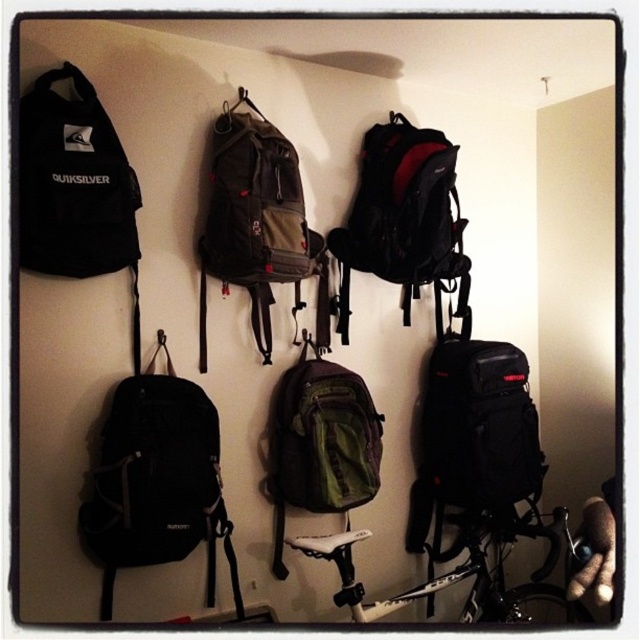
Question: Which of the following is the closest to the observer?

Choices:
 (A) shiny silver bicycle at lower center
 (B) black matte backpack at left
 (C) metallic silver hook at upper center
 (D) matte black backpack at center

Answer: (B)

Question: Does black matte backpack at left come in front of camouflage fabric backpack at center?

Choices:
 (A) yes
 (B) no

Answer: (A)

Question: Which object is closer to the camera taking this photo?

Choices:
 (A) camouflage fabric backpack at center
 (B) metallic silver hook at upper center
 (C) matte black backpack at center

Answer: (A)

Question: Which of the following is the farthest from the observer?

Choices:
 (A) camouflage fabric backpack at center
 (B) black matte backpack at left
 (C) metallic silver hook at upper center
 (D) shiny silver bicycle at lower center

Answer: (C)

Question: Does camouflage fabric backpack at center have a larger size compared to metallic silver hook at upper center?

Choices:
 (A) no
 (B) yes

Answer: (B)

Question: Where is matte black backpack at center located in relation to green fabric backpack at center in the image?

Choices:
 (A) right
 (B) left

Answer: (A)